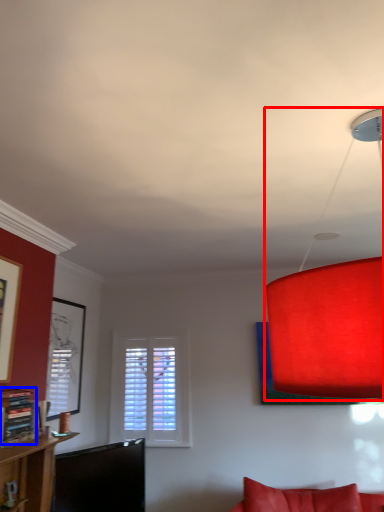
Question: Which object is further to the camera taking this photo, lamp (highlighted by a red box) or shelf (highlighted by a blue box)?

Choices:
 (A) lamp
 (B) shelf

Answer: (B)